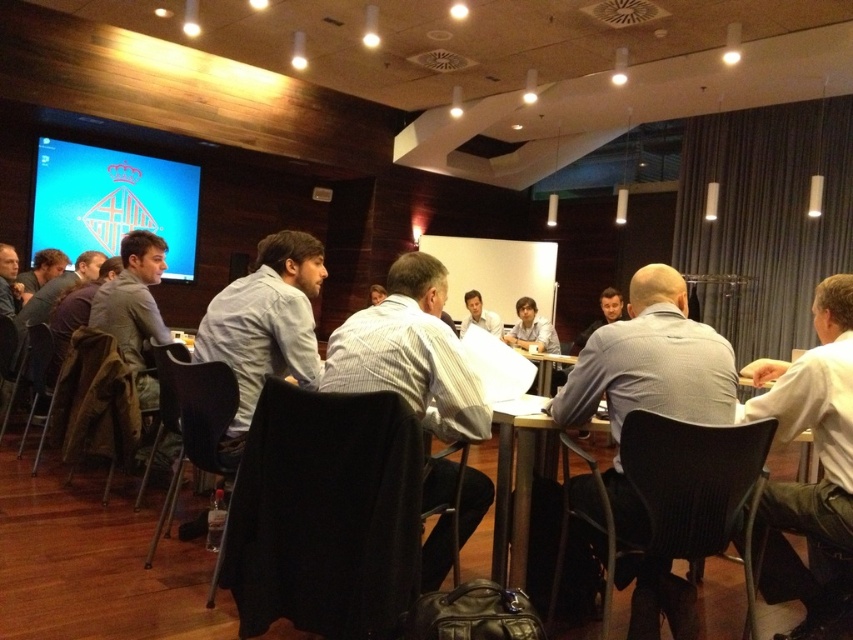
From the picture: Is white shirt at right shorter than matte white shirt at center?

Incorrect, white shirt at right's height does not fall short of matte white shirt at center's.

This screenshot has height=640, width=853. Identify the location of white shirt at right. (817, 458).

The image size is (853, 640). I want to click on white shirt at right, so click(817, 458).

Is wooden table at center to the right of matte black shirt at center from the viewer's perspective?

In fact, wooden table at center is to the left of matte black shirt at center.

Is wooden table at center closer to camera compared to matte black shirt at center?

Yes, wooden table at center is in front of matte black shirt at center.

You are a GUI agent. You are given a task and a screenshot of the screen. Output one action in this format:
    pyautogui.click(x=<x>, y=<y>)
    Task: Click on the wooden table at center
    The height and width of the screenshot is (640, 853).
    Given the screenshot: What is the action you would take?
    pyautogui.click(x=544, y=368)

Between white shirt at right and white shirt at center, which one has more height?

Standing taller between the two is white shirt at right.

Who is positioned more to the right, white shirt at right or white shirt at center?

white shirt at right

Is point (821, 589) positioned after point (270, 288)?

No.

Locate an element on the screen. Image resolution: width=853 pixels, height=640 pixels. white shirt at right is located at coordinates coord(817,458).